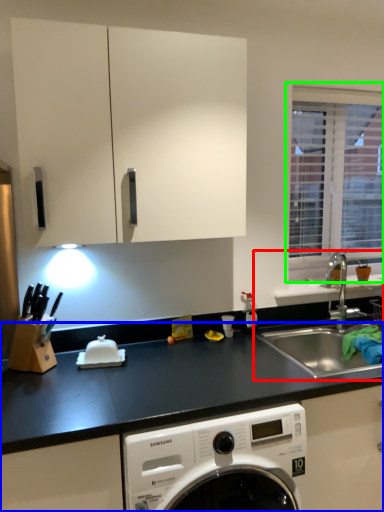
Question: Which object is the closest to the sink (highlighted by a red box)? Choose among these: countertop (highlighted by a blue box) or window (highlighted by a green box).

Choices:
 (A) countertop
 (B) window

Answer: (B)